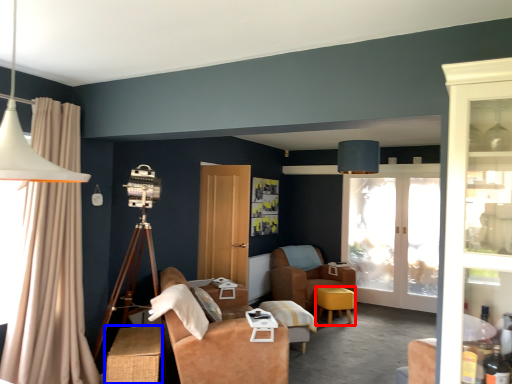
Question: Which of the following is the farthest to the observer, stool (highlighted by a red box) or table (highlighted by a blue box)?

Choices:
 (A) stool
 (B) table

Answer: (A)